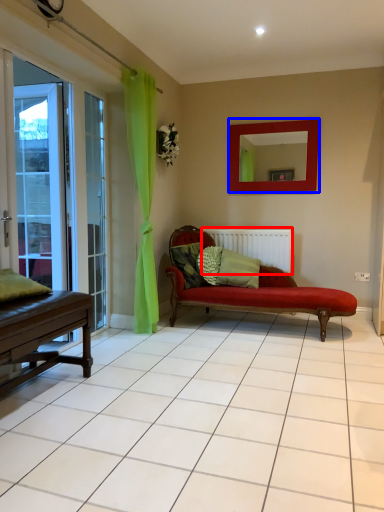
Question: Which object is further to the camera taking this photo, radiator (highlighted by a red box) or mirror (highlighted by a blue box)?

Choices:
 (A) radiator
 (B) mirror

Answer: (A)